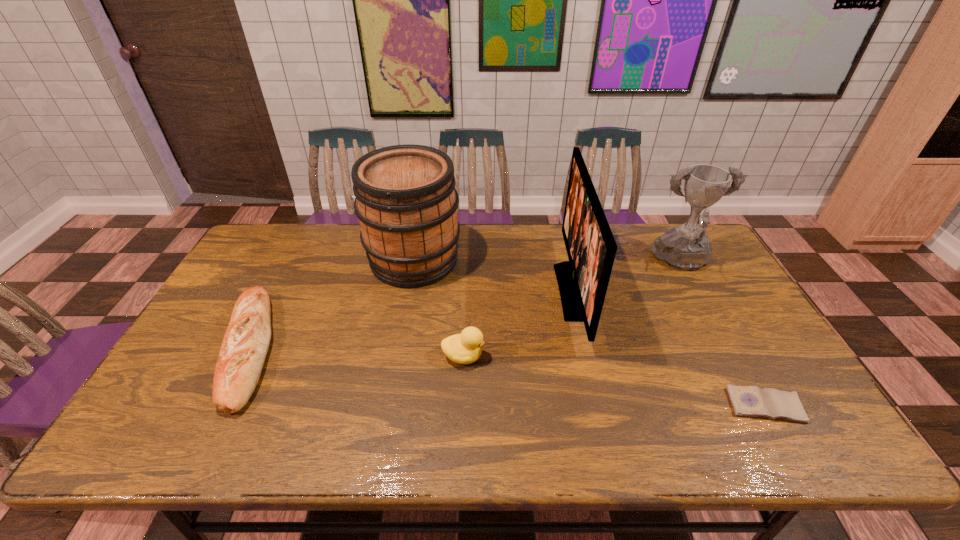
Locate an element on the screen. Image resolution: width=960 pixels, height=540 pixels. free space that is in between the diary and the baguet is located at coordinates (507, 377).

Where is `vacant area that lies between the cider and the award`? vacant area that lies between the cider and the award is located at coordinates (548, 261).

This screenshot has height=540, width=960. I want to click on free space between the monitor and the diary, so click(x=669, y=348).

Identify the location of unoccupied position between the baguet and the cider. The width and height of the screenshot is (960, 540). (331, 304).

Where is `free spot between the fourth object from left to right and the second shortest object`? free spot between the fourth object from left to right and the second shortest object is located at coordinates tap(411, 320).

The height and width of the screenshot is (540, 960). I want to click on free point between the monitor and the diary, so click(669, 348).

Where is `empty location between the duck and the baguet`? The width and height of the screenshot is (960, 540). empty location between the duck and the baguet is located at coordinates (356, 353).

Find the location of `object identified as the second closest to the baguet`. object identified as the second closest to the baguet is located at coordinates click(465, 348).

Image resolution: width=960 pixels, height=540 pixels. What are the coordinates of `the fourth closest object to the award` in the screenshot? It's located at (405, 199).

This screenshot has height=540, width=960. In order to click on vacant space that satisfies the following two spatial constraints: 1. on the front-facing side of the diary; 2. on the right side of the monitor in this screenshot , I will do `click(600, 406)`.